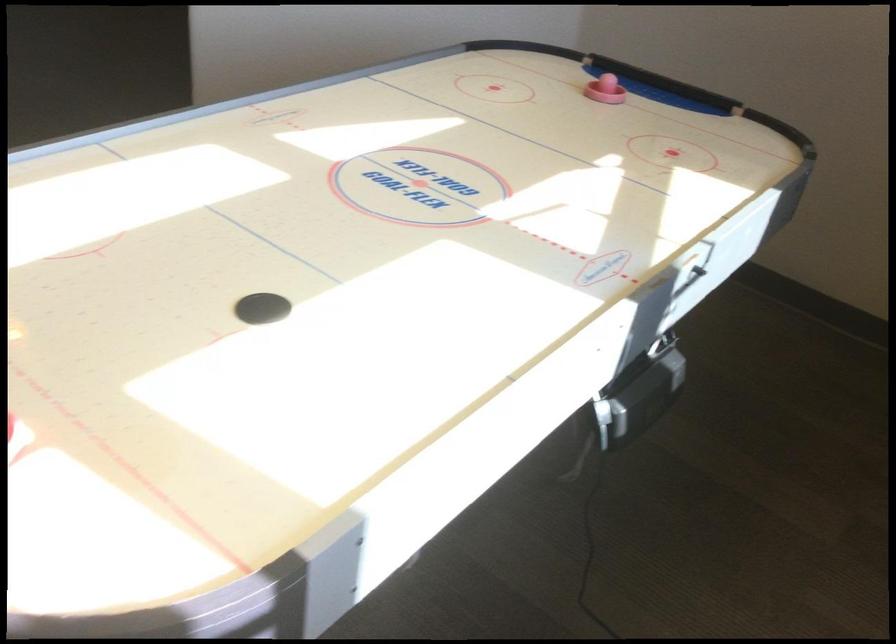
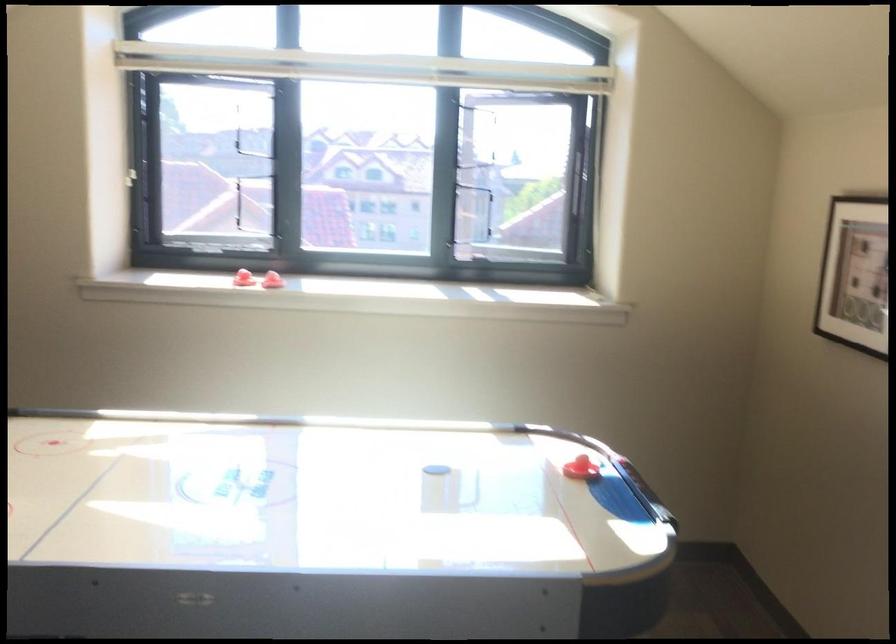
The point at (x=246, y=390) is marked in the first image. Where is the corresponding point in the second image?

(442, 467)